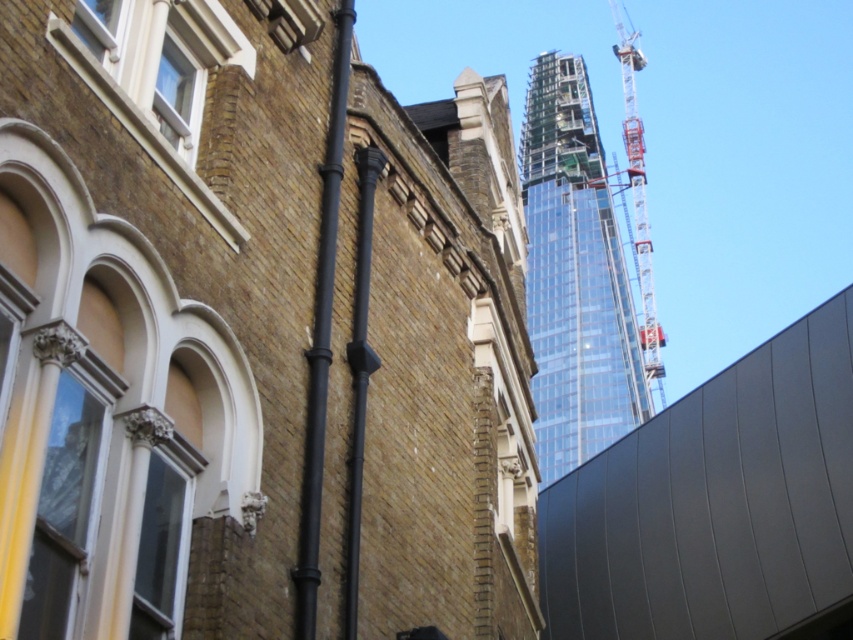
Question: Estimate the real-world distances between objects in this image. Which object is farther from the transparent glass tower at upper center?

Choices:
 (A) metallic gray crane at upper right
 (B) black matte pipe at center-left

Answer: (B)

Question: Does transparent glass tower at upper center come in front of metallic gray crane at upper right?

Choices:
 (A) no
 (B) yes

Answer: (B)

Question: Can you confirm if transparent glass tower at upper center is positioned above metallic gray crane at upper right?

Choices:
 (A) no
 (B) yes

Answer: (A)

Question: Is black matte pipe at center-left closer to the viewer compared to black matte pole at center?

Choices:
 (A) yes
 (B) no

Answer: (A)

Question: Among these objects, which one is nearest to the camera?

Choices:
 (A) transparent glass tower at upper center
 (B) black matte pole at center
 (C) black matte pipe at center-left
 (D) metallic gray crane at upper right

Answer: (C)

Question: Which point is farther to the camera?

Choices:
 (A) transparent glass tower at upper center
 (B) black matte pipe at center-left
 (C) metallic gray crane at upper right
 (D) black matte pole at center

Answer: (C)